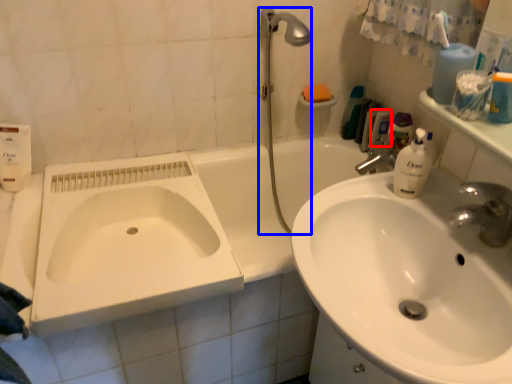
Question: Which of the following is the closest to the observer, mouthwash (highlighted by a red box) or shower (highlighted by a blue box)?

Choices:
 (A) mouthwash
 (B) shower

Answer: (B)